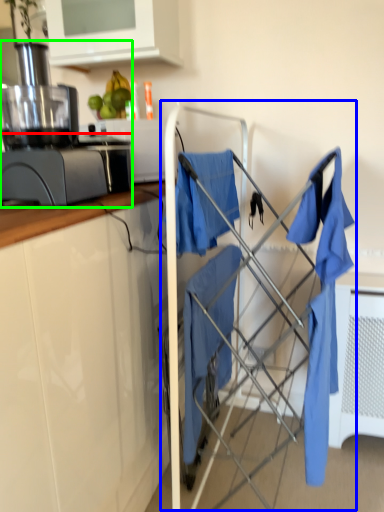
Question: Based on their relative distances, which object is nearer to kitchen appliance (highlighted by a red box)? Choose from baby carriage (highlighted by a blue box) and home appliance (highlighted by a green box).

Choices:
 (A) baby carriage
 (B) home appliance

Answer: (B)